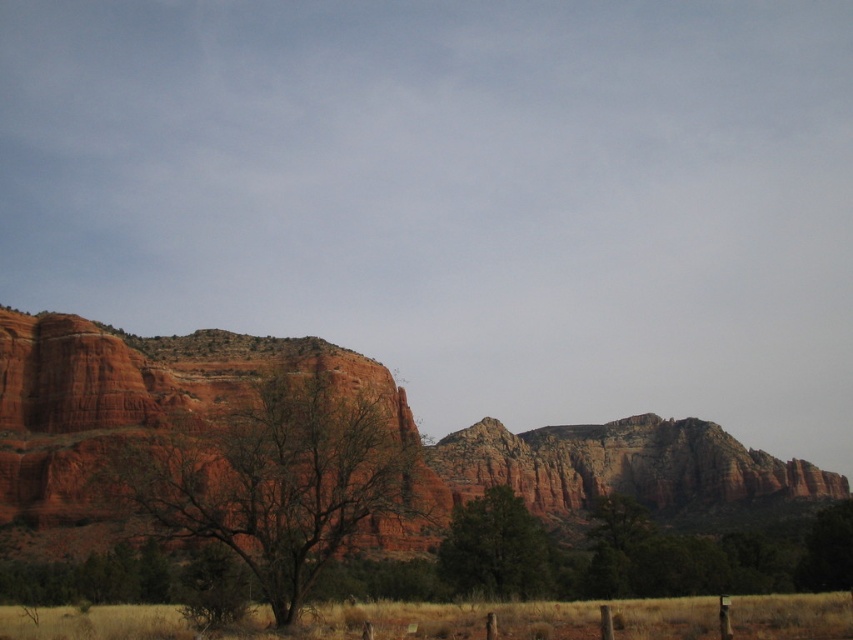
Does smooth reddish-brown tree at center-left have a lesser height compared to green matte tree at center?

In fact, smooth reddish-brown tree at center-left may be taller than green matte tree at center.

Who is more distant from viewer, [383,435] or [488,493]?

Positioned behind is point [488,493].

At what (x,y) coordinates should I click in order to perform the action: click on smooth reddish-brown tree at center-left. Please return your answer as a coordinate pair (x, y). Looking at the image, I should click on (276, 480).

Can you confirm if rustic rock formation at center is shorter than green matte tree at center?

In fact, rustic rock formation at center may be taller than green matte tree at center.

Locate an element on the screen. The width and height of the screenshot is (853, 640). rustic rock formation at center is located at coordinates (131, 403).

Find the location of a particular element. The height and width of the screenshot is (640, 853). rustic rock formation at center is located at coordinates (131, 403).

The height and width of the screenshot is (640, 853). I want to click on rustic rock formation at center, so click(x=131, y=403).

Can you confirm if rustic rock formation at center is positioned below smooth reddish-brown tree at center-left?

Yes.

Based on the photo, how far apart are rustic rock formation at center and smooth reddish-brown tree at center-left?

27.75 meters

Is point (728, 509) farther from viewer compared to point (235, 460)?

Yes.

Find the location of `rustic rock formation at center`. rustic rock formation at center is located at coordinates coord(131,403).